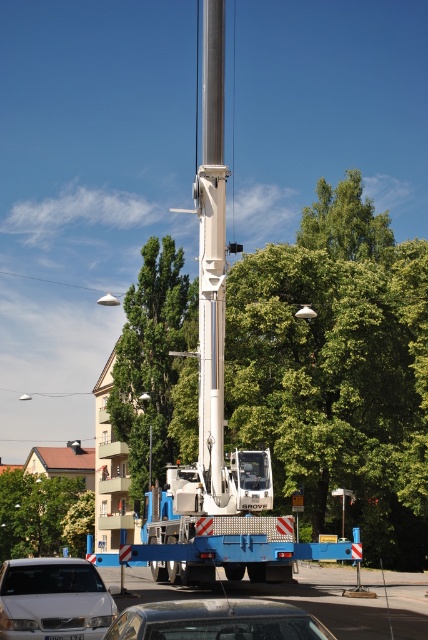
Question: Which point is closer to the camera?

Choices:
 (A) (214, 45)
 (B) (246, 625)
 (C) (45, 609)

Answer: (B)

Question: Is white matte car at lower left in front of shiny silver car at lower center?

Choices:
 (A) no
 (B) yes

Answer: (A)

Question: Can you confirm if silver metallic pole at center is positioned above shiny silver car at lower center?

Choices:
 (A) no
 (B) yes

Answer: (B)

Question: Does white matte car at lower left appear under shiny silver car at lower center?

Choices:
 (A) yes
 (B) no

Answer: (A)

Question: Estimate the real-world distances between objects in this image. Which object is farther from the shiny silver car at lower center?

Choices:
 (A) silver metallic pole at center
 (B) white matte car at lower left

Answer: (A)

Question: Among these objects, which one is nearest to the camera?

Choices:
 (A) shiny silver car at lower center
 (B) white matte car at lower left
 (C) silver metallic pole at center

Answer: (A)